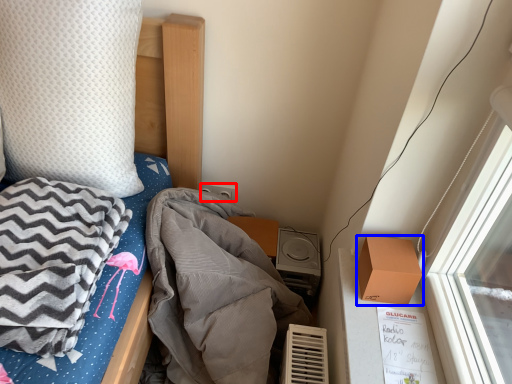
Question: Which object is further to the camera taking this photo, power plugs and sockets (highlighted by a red box) or box (highlighted by a blue box)?

Choices:
 (A) power plugs and sockets
 (B) box

Answer: (A)